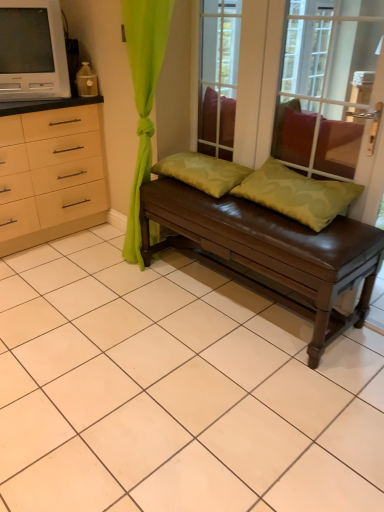
Question: From a real-world perspective, is green matte pillow at center, which is the second pillow from left to right, on top of brown leather bench at center?

Choices:
 (A) no
 (B) yes

Answer: (B)

Question: Does green matte pillow at center, which is the 1th pillow in right-to-left order, have a lesser width compared to brown leather bench at center?

Choices:
 (A) yes
 (B) no

Answer: (A)

Question: Can you confirm if green matte pillow at center, which is the 1th pillow in right-to-left order, is bigger than brown leather bench at center?

Choices:
 (A) yes
 (B) no

Answer: (B)

Question: Does green matte pillow at center, which is the 1th pillow in right-to-left order, have a lesser height compared to brown leather bench at center?

Choices:
 (A) yes
 (B) no

Answer: (A)

Question: Is brown leather bench at center located within green matte pillow at center, which is the second pillow from left to right?

Choices:
 (A) no
 (B) yes

Answer: (A)

Question: Is green matte pillow at center, which is the 1th pillow in right-to-left order, further to the viewer compared to brown leather bench at center?

Choices:
 (A) yes
 (B) no

Answer: (A)

Question: From a real-world perspective, is transparent glass window screen at upper center physically above green fabric pillow at center, marked as the first pillow in a left-to-right arrangement?

Choices:
 (A) no
 (B) yes

Answer: (B)

Question: Can you confirm if transparent glass window screen at upper center is wider than green fabric pillow at center, which ranks as the 2th pillow in right-to-left order?

Choices:
 (A) yes
 (B) no

Answer: (B)

Question: Is transparent glass window screen at upper center placed right next to green fabric pillow at center, which ranks as the 2th pillow in right-to-left order?

Choices:
 (A) yes
 (B) no

Answer: (B)

Question: From a real-world perspective, is transparent glass window screen at upper center located beneath green fabric pillow at center, marked as the first pillow in a left-to-right arrangement?

Choices:
 (A) no
 (B) yes

Answer: (A)

Question: Is transparent glass window screen at upper center closer to the viewer compared to green fabric pillow at center, marked as the first pillow in a left-to-right arrangement?

Choices:
 (A) no
 (B) yes

Answer: (B)

Question: Would you say transparent glass window screen at upper center is a long distance from green fabric pillow at center, marked as the first pillow in a left-to-right arrangement?

Choices:
 (A) yes
 (B) no

Answer: (A)

Question: Would you say transparent glass window screen at upper center is outside matte white television at upper left?

Choices:
 (A) yes
 (B) no

Answer: (A)